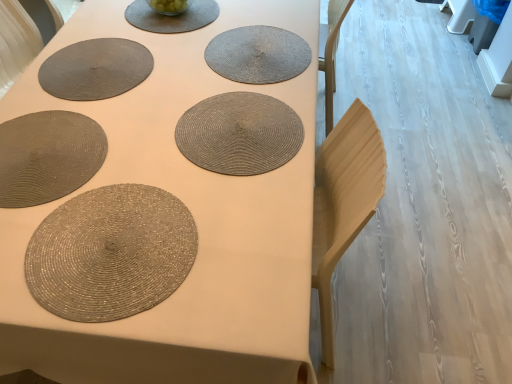
The image size is (512, 384). I want to click on vacant area that lies between rattan placemat at center, which is the 2th coaster in top-to-bottom order, and shiny metallic placemat at bottom left, the 1th paper plate in the bottom-to-top sequence, so click(183, 180).